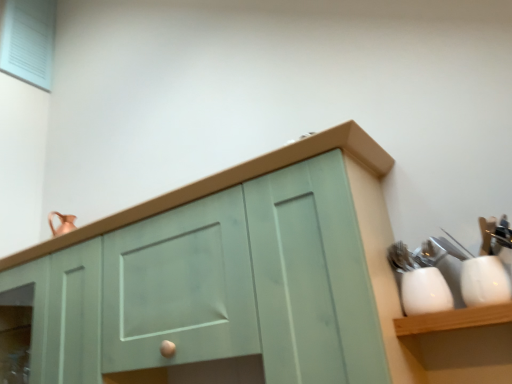
Identify the location of white glossy cup at right, which appears as the 1th tableware when viewed from the right. (484, 281).

This screenshot has height=384, width=512. In order to click on white glossy cup at right, arranged as the first tableware when viewed from the left in this screenshot , I will do `click(425, 292)`.

What is the approximate width of matte green cabinet at center?

The width of matte green cabinet at center is 13.74 inches.

At what (x,y) coordinates should I click in order to perform the action: click on matte green cabinet at center. Please return your answer as a coordinate pair (x, y). Looking at the image, I should click on coord(362,236).

Find the location of a particular element. This screenshot has height=384, width=512. white glossy cup at right, marked as the second tableware in a left-to-right arrangement is located at coordinates (484, 281).

Is matte green cabinet at center aimed at white glossy cup at right, which appears as the second tableware when viewed from the right?

No, matte green cabinet at center does not turn towards white glossy cup at right, which appears as the second tableware when viewed from the right.

Based on the photo, is matte green cabinet at center positioned beyond the bounds of white glossy cup at right, arranged as the first tableware when viewed from the left?

Indeed, matte green cabinet at center is completely outside white glossy cup at right, arranged as the first tableware when viewed from the left.

Does matte green cabinet at center have a lesser width compared to white glossy cup at right, arranged as the first tableware when viewed from the left?

No.

Measure the distance between matte green cabinet at center and white glossy cup at right, arranged as the first tableware when viewed from the left.

matte green cabinet at center and white glossy cup at right, arranged as the first tableware when viewed from the left, are 11.88 inches apart.

From the image's perspective, is white glossy cup at right, arranged as the first tableware when viewed from the left, under matte green cabinet at center?

No, from the image's perspective, white glossy cup at right, arranged as the first tableware when viewed from the left, is not beneath matte green cabinet at center.

Which object is further away from the camera, white glossy cup at right, arranged as the first tableware when viewed from the left, or matte green cabinet at center?

white glossy cup at right, arranged as the first tableware when viewed from the left, is more distant.

Considering the relative sizes of white glossy cup at right, which appears as the second tableware when viewed from the right, and matte green cabinet at center in the image provided, is white glossy cup at right, which appears as the second tableware when viewed from the right, taller than matte green cabinet at center?

No.

Is white glossy cup at right, marked as the second tableware in a left-to-right arrangement, positioned far away from white glossy cup at right, which appears as the second tableware when viewed from the right?

No, white glossy cup at right, marked as the second tableware in a left-to-right arrangement, is not far from white glossy cup at right, which appears as the second tableware when viewed from the right.

Is white glossy cup at right, marked as the second tableware in a left-to-right arrangement, further to the viewer compared to white glossy cup at right, arranged as the first tableware when viewed from the left?

No, the depth of white glossy cup at right, marked as the second tableware in a left-to-right arrangement, is less than that of white glossy cup at right, arranged as the first tableware when viewed from the left.

Is point (486, 263) positioned behind point (408, 308)?

No.

From a real-world perspective, is white glossy cup at right, arranged as the first tableware when viewed from the left, positioned above or below white glossy cup at right, which appears as the 1th tableware when viewed from the right?

Clearly, from a real-world perspective, white glossy cup at right, arranged as the first tableware when viewed from the left, is below white glossy cup at right, which appears as the 1th tableware when viewed from the right.

Is white glossy cup at right, which appears as the second tableware when viewed from the right, touching white glossy cup at right, which appears as the 1th tableware when viewed from the right?

Yes, white glossy cup at right, which appears as the second tableware when viewed from the right, is beside white glossy cup at right, which appears as the 1th tableware when viewed from the right.

Between white glossy cup at right, arranged as the first tableware when viewed from the left, and white glossy cup at right, which appears as the 1th tableware when viewed from the right, which one has more height?

Standing taller between the two is white glossy cup at right, arranged as the first tableware when viewed from the left.

In the scene shown: Could you tell me if white glossy cup at right, which appears as the second tableware when viewed from the right, is facing white glossy cup at right, which appears as the 1th tableware when viewed from the right?

No, white glossy cup at right, which appears as the second tableware when viewed from the right, is not facing towards white glossy cup at right, which appears as the 1th tableware when viewed from the right.

This screenshot has height=384, width=512. What are the coordinates of `cabinetry above the white glossy cup at right, marked as the second tableware in a left-to-right arrangement (from a real-world perspective)` in the screenshot? It's located at (362, 236).

Could you tell me if matte green cabinet at center is turned towards white glossy cup at right, marked as the second tableware in a left-to-right arrangement?

No, matte green cabinet at center is not turned towards white glossy cup at right, marked as the second tableware in a left-to-right arrangement.

Does matte green cabinet at center appear on the right side of white glossy cup at right, which appears as the 1th tableware when viewed from the right?

Incorrect, matte green cabinet at center is not on the right side of white glossy cup at right, which appears as the 1th tableware when viewed from the right.

Based on their sizes in the image, would you say matte green cabinet at center is bigger or smaller than white glossy cup at right, marked as the second tableware in a left-to-right arrangement?

Considering their sizes, matte green cabinet at center takes up more space than white glossy cup at right, marked as the second tableware in a left-to-right arrangement.

Considering their positions, is white glossy cup at right, marked as the second tableware in a left-to-right arrangement, located in front of or behind matte green cabinet at center?

white glossy cup at right, marked as the second tableware in a left-to-right arrangement, is behind matte green cabinet at center.

Is point (477, 293) in front of point (85, 233)?

Yes.

Does white glossy cup at right, which appears as the 1th tableware when viewed from the right, have a lesser width compared to matte green cabinet at center?

Yes.

Looking at this image, from the image's perspective, is white glossy cup at right, which appears as the 1th tableware when viewed from the right, under matte green cabinet at center?

Incorrect, from the image's perspective, white glossy cup at right, which appears as the 1th tableware when viewed from the right, is higher than matte green cabinet at center.

The height and width of the screenshot is (384, 512). Identify the location of cabinetry to the left of white glossy cup at right, arranged as the first tableware when viewed from the left. (362, 236).

From a real-world perspective, which tableware is the 2nd one underneath the matte green cabinet at center? Please provide its 2D coordinates.

[(425, 292)]

Estimate the real-world distances between objects in this image. Which object is closer to white glossy cup at right, arranged as the first tableware when viewed from the left, matte green cabinet at center or white glossy cup at right, marked as the second tableware in a left-to-right arrangement?

white glossy cup at right, marked as the second tableware in a left-to-right arrangement, is closer to white glossy cup at right, arranged as the first tableware when viewed from the left.

Looking at the image, which one is located closer to white glossy cup at right, which appears as the second tableware when viewed from the right, white glossy cup at right, which appears as the 1th tableware when viewed from the right, or matte green cabinet at center?

Based on the image, white glossy cup at right, which appears as the 1th tableware when viewed from the right, appears to be nearer to white glossy cup at right, which appears as the second tableware when viewed from the right.

Considering their positions, is white glossy cup at right, arranged as the first tableware when viewed from the left, positioned closer to white glossy cup at right, marked as the second tableware in a left-to-right arrangement, than matte green cabinet at center?

white glossy cup at right, arranged as the first tableware when viewed from the left.

From the image, which object appears to be nearer to matte green cabinet at center, white glossy cup at right, arranged as the first tableware when viewed from the left, or white glossy cup at right, marked as the second tableware in a left-to-right arrangement?

white glossy cup at right, arranged as the first tableware when viewed from the left, lies closer to matte green cabinet at center than the other object.

Looking at the image, which one is located further to matte green cabinet at center, white glossy cup at right, marked as the second tableware in a left-to-right arrangement, or white glossy cup at right, arranged as the first tableware when viewed from the left?

Based on the image, white glossy cup at right, marked as the second tableware in a left-to-right arrangement, appears to be further to matte green cabinet at center.

When comparing their distances from white glossy cup at right, which appears as the 1th tableware when viewed from the right, does matte green cabinet at center or white glossy cup at right, which appears as the second tableware when viewed from the right, seem closer?

white glossy cup at right, which appears as the second tableware when viewed from the right, is closer to white glossy cup at right, which appears as the 1th tableware when viewed from the right.

You are a GUI agent. You are given a task and a screenshot of the screen. Output one action in this format:
    pyautogui.click(x=<x>, y=<y>)
    Task: Click on the tableware between matte green cabinet at center and white glossy cup at right, marked as the second tableware in a left-to-right arrangement, in the horizontal direction
    This screenshot has height=384, width=512.
    Given the screenshot: What is the action you would take?
    pyautogui.click(x=425, y=292)